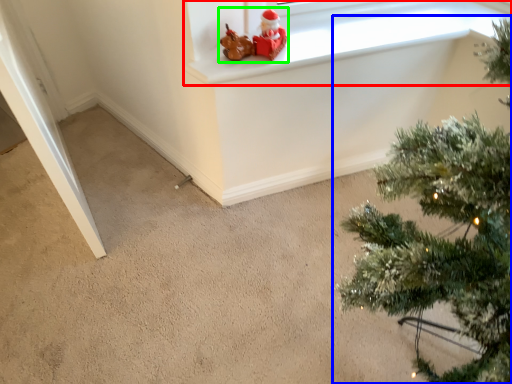
Question: Which is nearer to the window frame (highlighted by a red box)? christmas tree (highlighted by a blue box) or toy (highlighted by a green box).

Choices:
 (A) christmas tree
 (B) toy

Answer: (B)